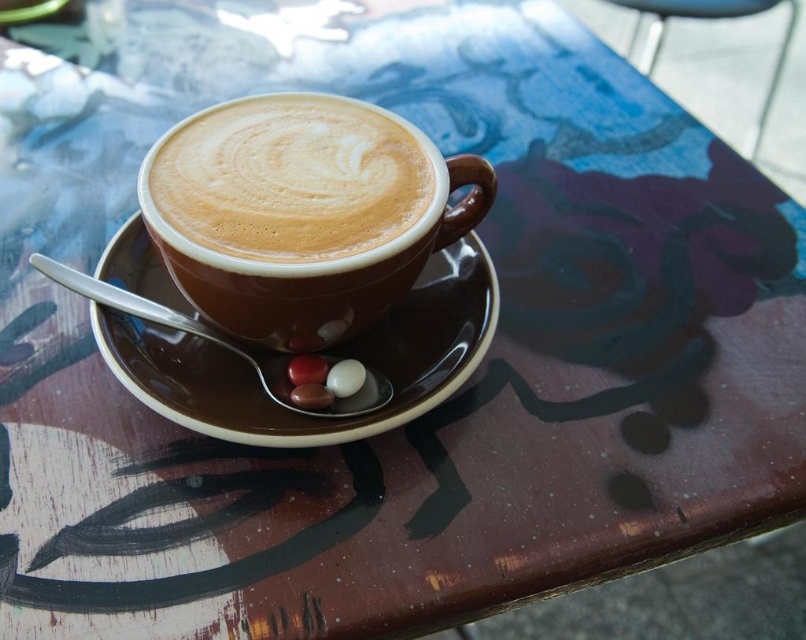
Question: Which point is farther from the camera taking this photo?

Choices:
 (A) (218, 422)
 (B) (285, 161)

Answer: (B)

Question: Does cappuccino foam at center appear on the left side of brown ceramic saucer at center?

Choices:
 (A) no
 (B) yes

Answer: (B)

Question: Does cappuccino foam at center have a greater width compared to brown ceramic saucer at center?

Choices:
 (A) yes
 (B) no

Answer: (B)

Question: Does cappuccino foam at center have a smaller size compared to brown ceramic saucer at center?

Choices:
 (A) no
 (B) yes

Answer: (B)